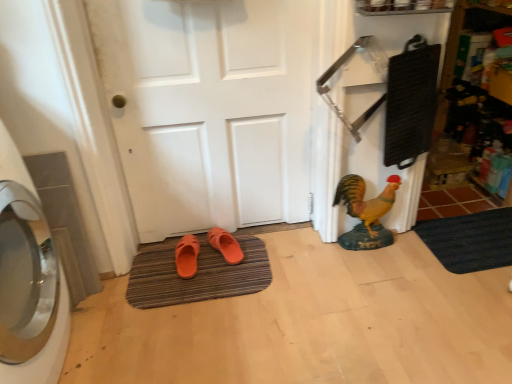
Where is `vacant space that's between shiny yellow statue at right and black rubber bath mat at lower right, marked as the second bath mat in a left-to-right arrangement`? The width and height of the screenshot is (512, 384). vacant space that's between shiny yellow statue at right and black rubber bath mat at lower right, marked as the second bath mat in a left-to-right arrangement is located at coordinates (400, 256).